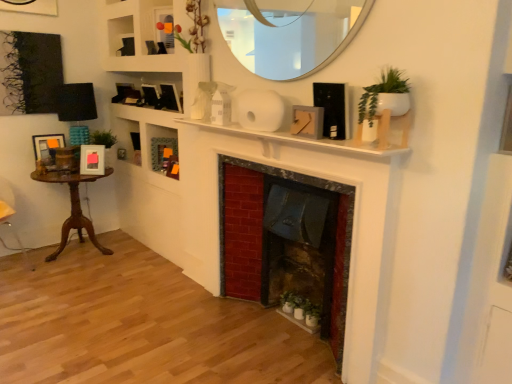
Find the location of `red brick fireplace at center`. red brick fireplace at center is located at coordinates (308, 185).

Describe the element at coordinates (47, 143) in the screenshot. I see `wooden picture frame at left, arranged as the 5th picture frame when viewed from the right` at that location.

In order to face green matte cabinet at center, should I rotate leftwards or rightwards?

A 12.045 degree turn to the left will do.

Describe the element at coordinates (320, 139) in the screenshot. This screenshot has height=384, width=512. I see `white matte fireplace at center` at that location.

Where is `green matte plant at lower center`? This screenshot has width=512, height=384. green matte plant at lower center is located at coordinates (298, 306).

Image resolution: width=512 pixels, height=384 pixels. In order to click on picture frame behind the wooden picture frame at upper center, marked as the second picture frame in a back-to-front arrangement in this screenshot , I will do `click(47, 143)`.

Is wooden picture frame at upper center, which appears as the fourth picture frame when viewed from the front, facing towards wooden picture frame at left, arranged as the 5th picture frame when viewed from the right?

No, wooden picture frame at upper center, which appears as the fourth picture frame when viewed from the front, is not facing towards wooden picture frame at left, arranged as the 5th picture frame when viewed from the right.

Considering the sizes of wooden picture frame at upper center, the third picture frame from the right, and wooden picture frame at left, arranged as the 5th picture frame when viewed from the right, in the image, is wooden picture frame at upper center, the third picture frame from the right, bigger or smaller than wooden picture frame at left, arranged as the 5th picture frame when viewed from the right,?

Clearly, wooden picture frame at upper center, the third picture frame from the right, is larger in size than wooden picture frame at left, arranged as the 5th picture frame when viewed from the right.

Is the depth of wooden picture frame at upper center, the 3th picture frame in the left-to-right sequence, greater than that of wooden picture frame at left, arranged as the 5th picture frame when viewed from the right?

No, it is in front of wooden picture frame at left, arranged as the 5th picture frame when viewed from the right.

Considering the sizes of objects wooden picture frame at upper center, marked as the second picture frame in a back-to-front arrangement, and green matte cabinet at center in the image provided, who is bigger, wooden picture frame at upper center, marked as the second picture frame in a back-to-front arrangement, or green matte cabinet at center?

Bigger between the two is wooden picture frame at upper center, marked as the second picture frame in a back-to-front arrangement.

Is wooden picture frame at upper center, which appears as the fourth picture frame when viewed from the front, with green matte cabinet at center?

No, wooden picture frame at upper center, which appears as the fourth picture frame when viewed from the front, is not making contact with green matte cabinet at center.

From the image's perspective, between wooden picture frame at upper center, marked as the second picture frame in a back-to-front arrangement, and green matte cabinet at center, who is located below?

From the image's view, green matte cabinet at center is below.

Is wooden picture frame at left, arranged as the 5th picture frame when viewed from the right, taller than matte black picture frame at upper center, which is the second picture frame from right to left?

Indeed, wooden picture frame at left, arranged as the 5th picture frame when viewed from the right, has a greater height compared to matte black picture frame at upper center, which is the second picture frame from right to left.

Looking at this image, is matte black picture frame at upper center, which is counted as the 4th picture frame, starting from the back, inside wooden picture frame at left, the 5th picture frame in the front-to-back sequence?

No, matte black picture frame at upper center, which is counted as the 4th picture frame, starting from the back, is located outside of wooden picture frame at left, the 5th picture frame in the front-to-back sequence.

Which point is more forward, [38,151] or [174,96]?

The point [174,96] is more forward.

From the picture: From a real-world perspective, does wooden picture frame at left, the first picture frame positioned from the back, stand above matte black picture frame at upper center, which is counted as the 4th picture frame, starting from the back?

Incorrect, from a real-world perspective, wooden picture frame at left, the first picture frame positioned from the back, is lower than matte black picture frame at upper center, which is counted as the 4th picture frame, starting from the back.

Is red brick fireplace at center located outside wooden picture frame at left, the 5th picture frame in the front-to-back sequence?

Yes, red brick fireplace at center is outside of wooden picture frame at left, the 5th picture frame in the front-to-back sequence.

Can you confirm if red brick fireplace at center is shorter than wooden picture frame at left, which appears as the first picture frame when viewed from the left?

Incorrect, the height of red brick fireplace at center does not fall short of that of wooden picture frame at left, which appears as the first picture frame when viewed from the left.

Considering the points (341, 355) and (37, 140), which point is behind, point (341, 355) or point (37, 140)?

The point (37, 140) is behind.

From a real-world perspective, which is physically above, red brick fireplace at center or wooden picture frame at left, the first picture frame positioned from the back?

wooden picture frame at left, the first picture frame positioned from the back, from a real-world perspective.

Which of these two, wooden table at left or white glossy mirror at upper center, is wider?

wooden table at left.

From a real-world perspective, is wooden table at left beneath white glossy mirror at upper center?

Yes, from a real-world perspective, wooden table at left is under white glossy mirror at upper center.

You are a GUI agent. You are given a task and a screenshot of the screen. Output one action in this format:
    pyautogui.click(x=<x>, y=<y>)
    Task: Click on the table behind the white glossy mirror at upper center
    The width and height of the screenshot is (512, 384).
    Given the screenshot: What is the action you would take?
    pyautogui.click(x=73, y=207)

Considering the sizes of objects wooden table at left and white glossy mirror at upper center in the image provided, who is taller, wooden table at left or white glossy mirror at upper center?

A: With more height is wooden table at left.

Would you say wooden picture frame at upper center, the 3th picture frame in the left-to-right sequence, contains white glossy mirror at upper center?

No, white glossy mirror at upper center is not inside wooden picture frame at upper center, the 3th picture frame in the left-to-right sequence.

From the image's perspective, which one is positioned lower, wooden picture frame at upper center, the third picture frame from the right, or white glossy mirror at upper center?

white glossy mirror at upper center appears lower in the image.

Considering the sizes of wooden picture frame at upper center, marked as the second picture frame in a back-to-front arrangement, and white glossy mirror at upper center in the image, is wooden picture frame at upper center, marked as the second picture frame in a back-to-front arrangement, wider or thinner than white glossy mirror at upper center?

Considering their sizes, wooden picture frame at upper center, marked as the second picture frame in a back-to-front arrangement, looks broader than white glossy mirror at upper center.

Which is in front, point (89, 148) or point (161, 93)?

The point (161, 93) is more forward.

Is matte white picture frame at left, placed as the 3th picture frame when sorted from back to front, oriented away from matte black picture frame at upper center, which is the second picture frame from right to left?

No, matte black picture frame at upper center, which is the second picture frame from right to left, is not at the back of matte white picture frame at left, placed as the 3th picture frame when sorted from back to front.

From the image's perspective, is matte white picture frame at left, which is the third picture frame in front-to-back order, located above or below matte black picture frame at upper center, which is counted as the 4th picture frame, starting from the back?

matte white picture frame at left, which is the third picture frame in front-to-back order, is situated lower than matte black picture frame at upper center, which is counted as the 4th picture frame, starting from the back, in the image.

There is a wooden picture frame at left, arranged as the 5th picture frame when viewed from the right. Identify the location of the 2nd picture frame above it (from a real-world perspective). click(x=150, y=95).

Where is `cabinet directly beneath the wooden picture frame at upper center, the third picture frame from the right (from a real-world perspective)`? This screenshot has height=384, width=512. cabinet directly beneath the wooden picture frame at upper center, the third picture frame from the right (from a real-world perspective) is located at coordinates (163, 149).

When comparing their distances from matte gray picture frame at center, the 5th picture frame in the left-to-right sequence, does wooden picture frame at left, the first picture frame positioned from the back, or wooden table at left seem further?

wooden picture frame at left, the first picture frame positioned from the back.

From the image, which object appears to be nearer to white matte fireplace at center, matte gray picture frame at center, marked as the fifth picture frame in a back-to-front arrangement, or red brick fireplace at center?

matte gray picture frame at center, marked as the fifth picture frame in a back-to-front arrangement, is positioned closer to the anchor white matte fireplace at center.

Looking at the image, which one is located further to wooden picture frame at upper center, the 3th picture frame in the left-to-right sequence, green matte plant at lower center or wooden picture frame at left, the first picture frame positioned from the back?

Among the two, green matte plant at lower center is located further to wooden picture frame at upper center, the 3th picture frame in the left-to-right sequence.

When comparing their distances from green matte plant at lower center, does matte white picture frame at left, placed as the 3th picture frame when sorted from back to front, or matte black picture frame at upper center, which is the second picture frame from right to left, seem closer?

matte black picture frame at upper center, which is the second picture frame from right to left.

Estimate the real-world distances between objects in this image. Which object is further from matte black picture frame at upper center, which is the second picture frame from right to left, matte gray picture frame at center, the 1th picture frame when ordered from right to left, or white glossy mirror at upper center?

Based on the image, matte gray picture frame at center, the 1th picture frame when ordered from right to left, appears to be further to matte black picture frame at upper center, which is the second picture frame from right to left.

When comparing their distances from white glossy mirror at upper center, does wooden table at left or green matte plant at lower center seem further?

wooden table at left.

Based on their spatial positions, is wooden picture frame at upper center, the 3th picture frame in the left-to-right sequence, or red brick fireplace at center closer to green matte plant at lower center?

red brick fireplace at center lies closer to green matte plant at lower center than the other object.

In the scene shown: Looking at the image, which one is located closer to matte gray picture frame at center, the 5th picture frame in the left-to-right sequence, white glossy mirror at upper center or wooden picture frame at left, the first picture frame positioned from the back?

white glossy mirror at upper center lies closer to matte gray picture frame at center, the 5th picture frame in the left-to-right sequence, than the other object.

Locate an element on the screen. Image resolution: width=512 pixels, height=384 pixels. table between white matte fireplace at center and wooden picture frame at left, which appears as the first picture frame when viewed from the left, along the z-axis is located at coordinates click(73, 207).

Locate an element on the screen. mantle between matte gray picture frame at center, positioned as the first picture frame in front-to-back order, and green matte plant at lower center from top to bottom is located at coordinates (320, 139).

Where is `cabinet between wooden table at left and green matte plant at lower center`? This screenshot has height=384, width=512. cabinet between wooden table at left and green matte plant at lower center is located at coordinates (163, 149).

I want to click on fireplace between matte black picture frame at upper center, which is counted as the 4th picture frame, starting from the back, and green matte plant at lower center from top to bottom, so click(x=308, y=185).